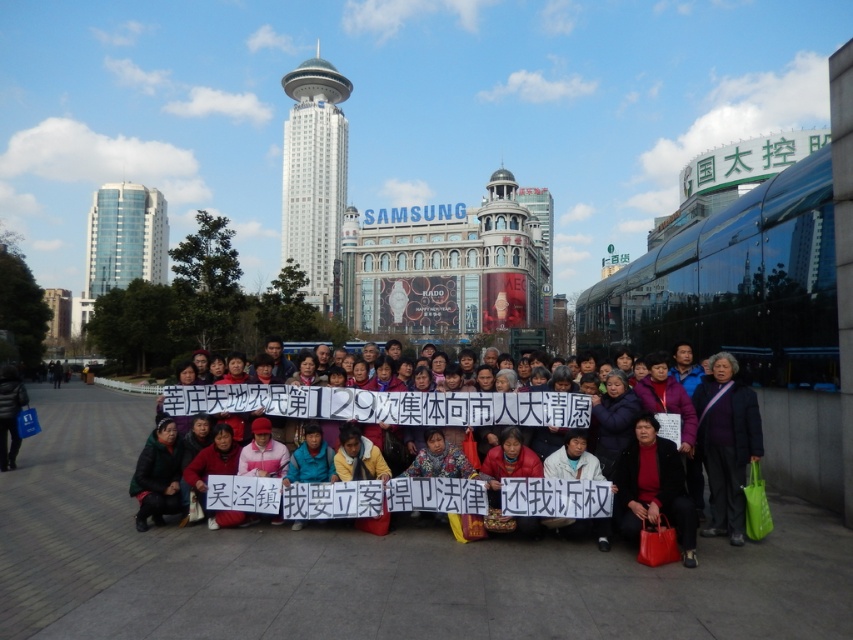
Between point (325, 182) and point (148, 237), which one is positioned behind?

Point (325, 182)

Between white glass tower at center and glassy blue skyscraper at upper left, which one is positioned higher?

white glass tower at center is higher up.

Who is more forward, (x=294, y=234) or (x=165, y=256)?

Point (x=165, y=256) is in front.

The width and height of the screenshot is (853, 640). I want to click on white glass tower at center, so click(314, 177).

Which is more to the right, multicolored fabric banner at center or white glass tower at center?

multicolored fabric banner at center is more to the right.

Which of these two, multicolored fabric banner at center or white glass tower at center, stands taller?

Standing taller between the two is white glass tower at center.

The width and height of the screenshot is (853, 640). I want to click on multicolored fabric banner at center, so click(x=392, y=404).

Image resolution: width=853 pixels, height=640 pixels. In order to click on multicolored fabric banner at center in this screenshot , I will do `click(392, 404)`.

Who is shorter, multicolored fabric banner at center or glassy blue skyscraper at upper left?

Standing shorter between the two is multicolored fabric banner at center.

Is multicolored fabric banner at center shorter than glassy blue skyscraper at upper left?

Yes, multicolored fabric banner at center is shorter than glassy blue skyscraper at upper left.

What are the coordinates of `multicolored fabric banner at center` in the screenshot? It's located at (392, 404).

Locate an element on the screen. The width and height of the screenshot is (853, 640). multicolored fabric banner at center is located at coordinates (392, 404).